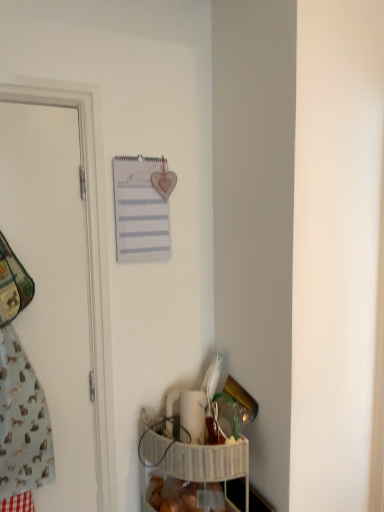
Question: From the image's perspective, relative to white woven basket at lower right, is translucent plastic bag of bread at lower center above or below?

Choices:
 (A) above
 (B) below

Answer: (B)

Question: Visually, is translucent plastic bag of bread at lower center positioned to the left or to the right of white woven basket at lower right?

Choices:
 (A) right
 (B) left

Answer: (B)

Question: Which is farther from the light blue fabric at left?

Choices:
 (A) white matte door at left
 (B) translucent plastic bag of bread at lower center
 (C) white paper journal at upper center
 (D) white woven basket at lower right

Answer: (B)

Question: Which of these objects is positioned closest to the white matte door at left?

Choices:
 (A) light blue fabric at left
 (B) translucent plastic bag of bread at lower center
 (C) white woven basket at lower right
 (D) white paper journal at upper center

Answer: (A)